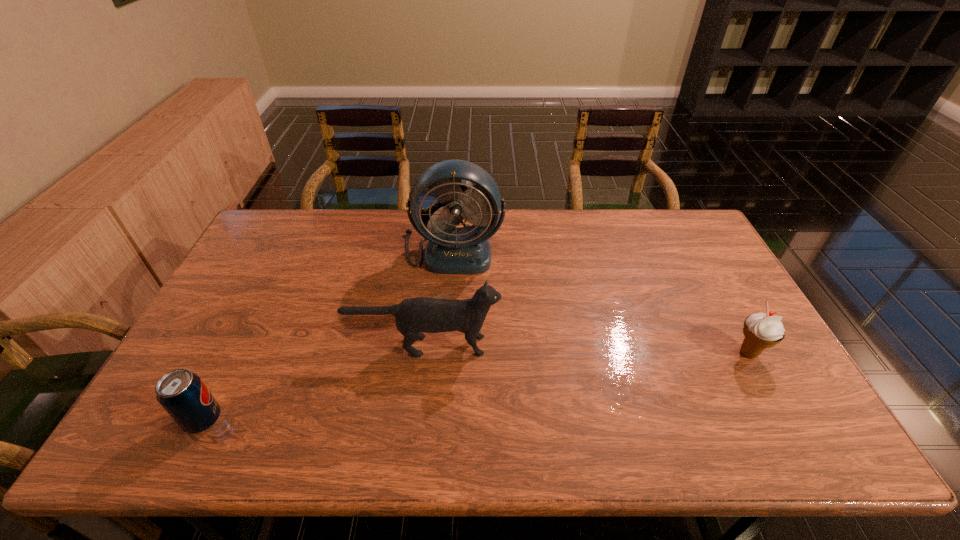
Identify the location of object present at the far edge. Image resolution: width=960 pixels, height=540 pixels. [x=465, y=250].

Image resolution: width=960 pixels, height=540 pixels. Find the location of `object at the near edge`. object at the near edge is located at coordinates (184, 396).

You are a GUI agent. You are given a task and a screenshot of the screen. Output one action in this format:
    pyautogui.click(x=<x>, y=<y>)
    Task: Click on the object located in the left edge section of the desktop
    
    Given the screenshot: What is the action you would take?
    pyautogui.click(x=184, y=396)

You are a GUI agent. You are given a task and a screenshot of the screen. Output one action in this format:
    pyautogui.click(x=<x>, y=<y>)
    Task: Click on the object at the right edge
    
    Given the screenshot: What is the action you would take?
    pyautogui.click(x=761, y=330)

What are the coordinates of `object that is at the near left corner` in the screenshot? It's located at (184, 396).

Locate an element on the screen. This screenshot has height=540, width=960. vacant space at the far edge of the desktop is located at coordinates (636, 210).

Find the location of a particular element. This screenshot has width=960, height=540. free space at the near edge of the desktop is located at coordinates (488, 449).

Identify the location of vacant space at the left edge of the desktop. (228, 306).

Find the location of `vacant space at the right edge of the desktop`. vacant space at the right edge of the desktop is located at coordinates (703, 318).

Image resolution: width=960 pixels, height=540 pixels. Find the location of `vacant region at the near left corner of the desktop`. vacant region at the near left corner of the desktop is located at coordinates pos(204,433).